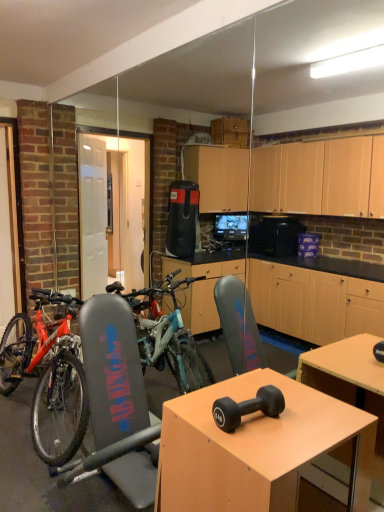
The width and height of the screenshot is (384, 512). What are the coordinates of `free space to the left of black rubber dumbbell at center` in the screenshot? It's located at (194, 413).